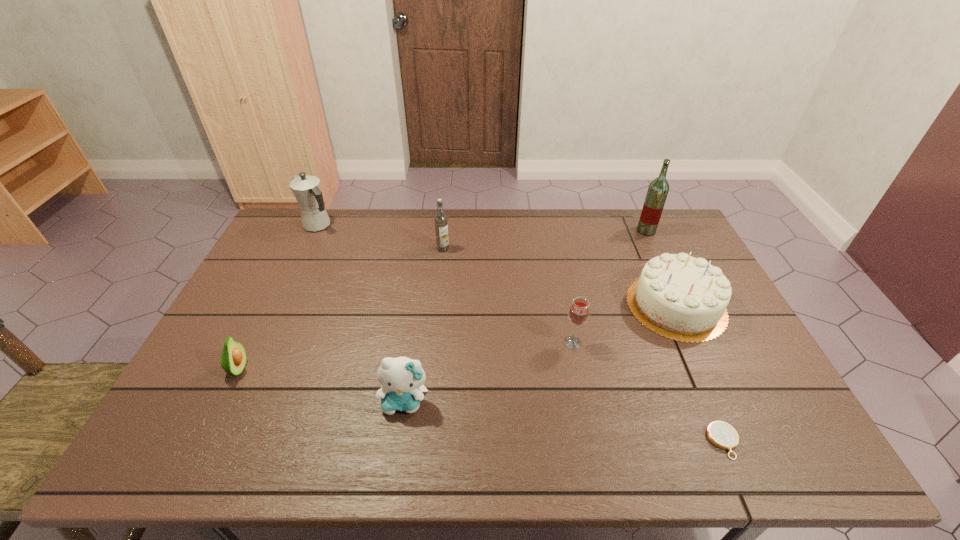
The image size is (960, 540). What are the coordinates of `the tallest object` in the screenshot? It's located at (658, 189).

Find the location of a particular element. Image resolution: width=960 pixels, height=540 pixels. coffeepot is located at coordinates (306, 189).

Where is `the sixth nearest object`? Image resolution: width=960 pixels, height=540 pixels. the sixth nearest object is located at coordinates (441, 225).

This screenshot has width=960, height=540. I want to click on birthday cake, so click(683, 298).

The width and height of the screenshot is (960, 540). Find the location of `wineglass`. wineglass is located at coordinates (579, 311).

Where is `kitten`? The image size is (960, 540). kitten is located at coordinates (402, 377).

Locate an element on the screen. avocado is located at coordinates (233, 359).

Where is `the sixth farthest object`? The height and width of the screenshot is (540, 960). the sixth farthest object is located at coordinates (233, 359).

At what (x,y) coordinates should I click in order to perform the action: click on the shortest object. Please return your answer as a coordinate pair (x, y). Looking at the image, I should click on click(x=721, y=434).

I want to click on compass, so click(721, 434).